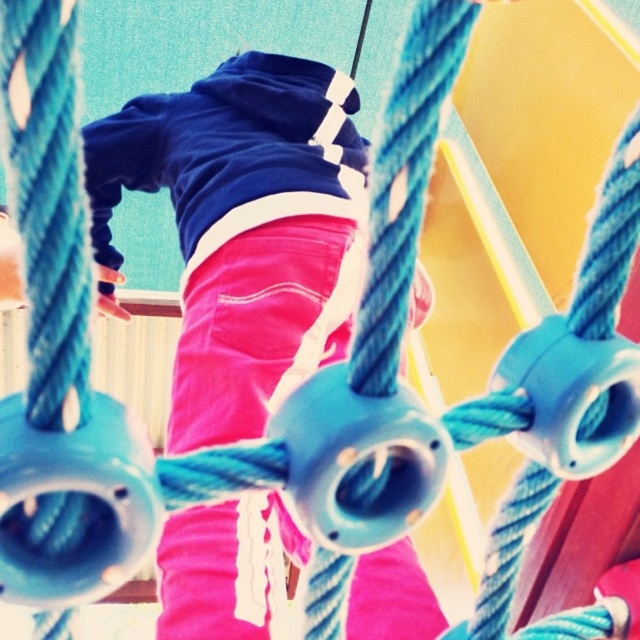
Question: Is pink corduroy pants at center below velvet blue sweatshirt at upper center?

Choices:
 (A) yes
 (B) no

Answer: (A)

Question: Which of the following is the farthest from the observer?

Choices:
 (A) velvet blue sweatshirt at upper center
 (B) pink corduroy pants at center

Answer: (A)

Question: Can you confirm if pink corduroy pants at center is positioned below velvet blue sweatshirt at upper center?

Choices:
 (A) yes
 (B) no

Answer: (A)

Question: Among these points, which one is nearest to the camera?

Choices:
 (A) (276, 138)
 (B) (300, 92)

Answer: (A)

Question: Does pink corduroy pants at center have a lesser width compared to velvet blue sweatshirt at upper center?

Choices:
 (A) yes
 (B) no

Answer: (B)